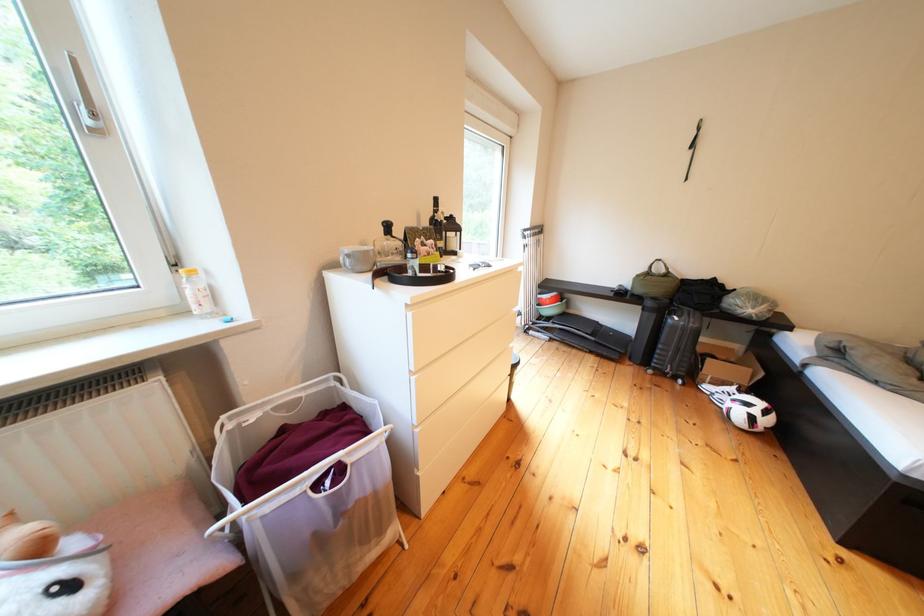
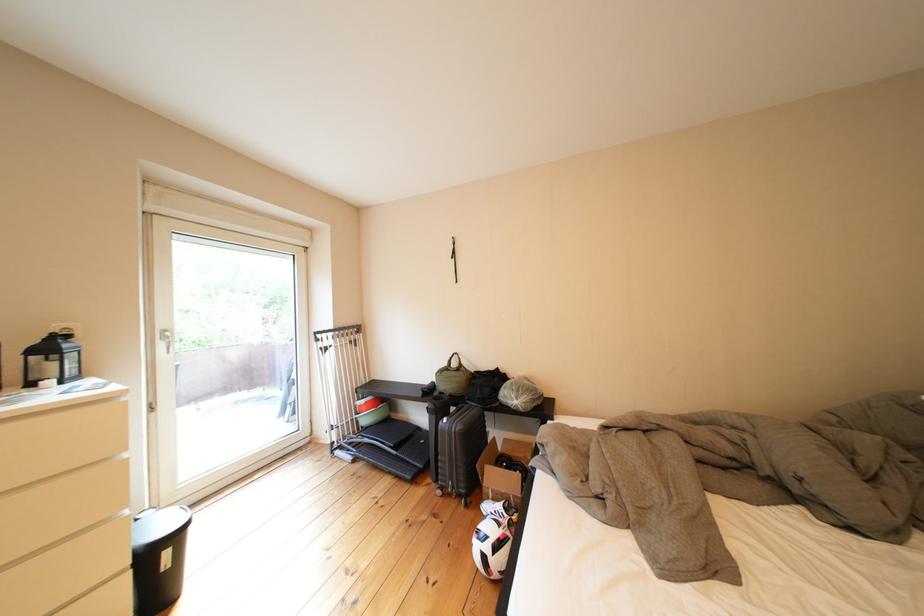
Find the pixel in the second image that matches (727,371) in the first image.

(505, 480)